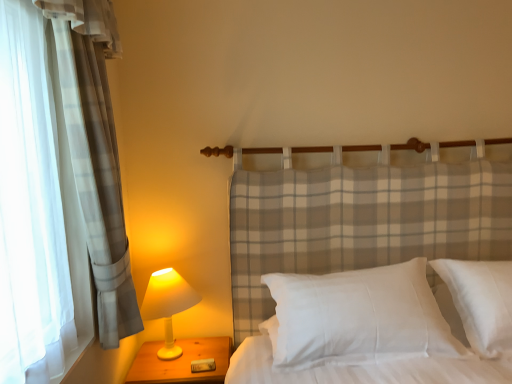
Question: From a real-world perspective, is white satin pillow at center physically located above or below white cotton pillow at center?

Choices:
 (A) above
 (B) below

Answer: (B)

Question: Considering their positions, is white satin pillow at center located in front of or behind white cotton pillow at center?

Choices:
 (A) front
 (B) behind

Answer: (B)

Question: Which object is positioned farthest from the white matte lamp at left?

Choices:
 (A) white satin pillow at center
 (B) wooden nightstand at lower left
 (C) white cotton pillow at center

Answer: (A)

Question: Estimate the real-world distances between objects in this image. Which object is farther from the white matte lamp at left?

Choices:
 (A) wooden nightstand at lower left
 (B) white satin pillow at center
 (C) white cotton pillow at center

Answer: (B)